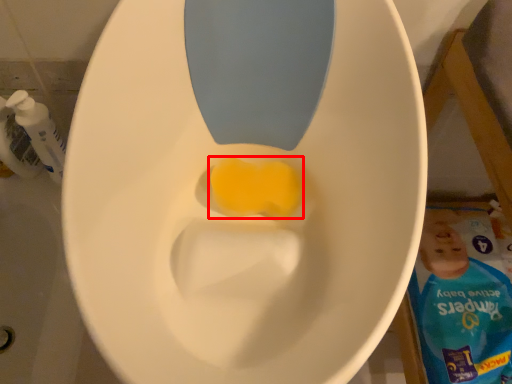
Question: From the image's perspective, what is the correct spatial positioning of food (annotated by the red box) in reference to cleaning product?

Choices:
 (A) below
 (B) above

Answer: (A)